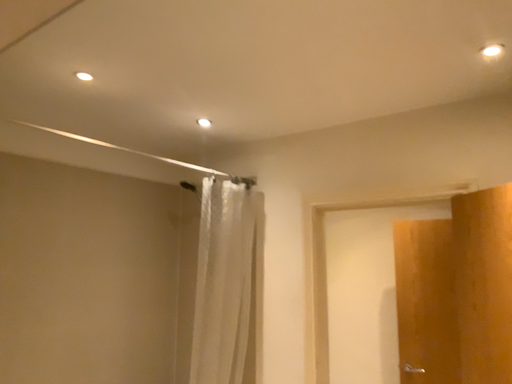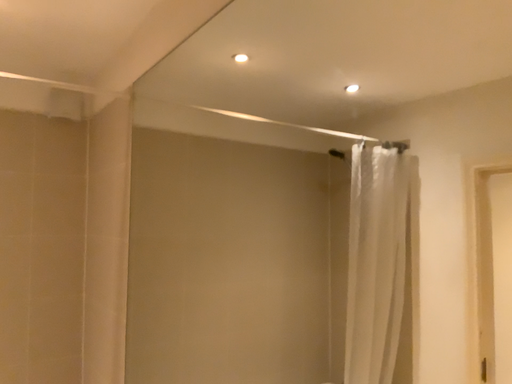
Question: Which way did the camera rotate in the video?

Choices:
 (A) rotated left
 (B) rotated right

Answer: (A)